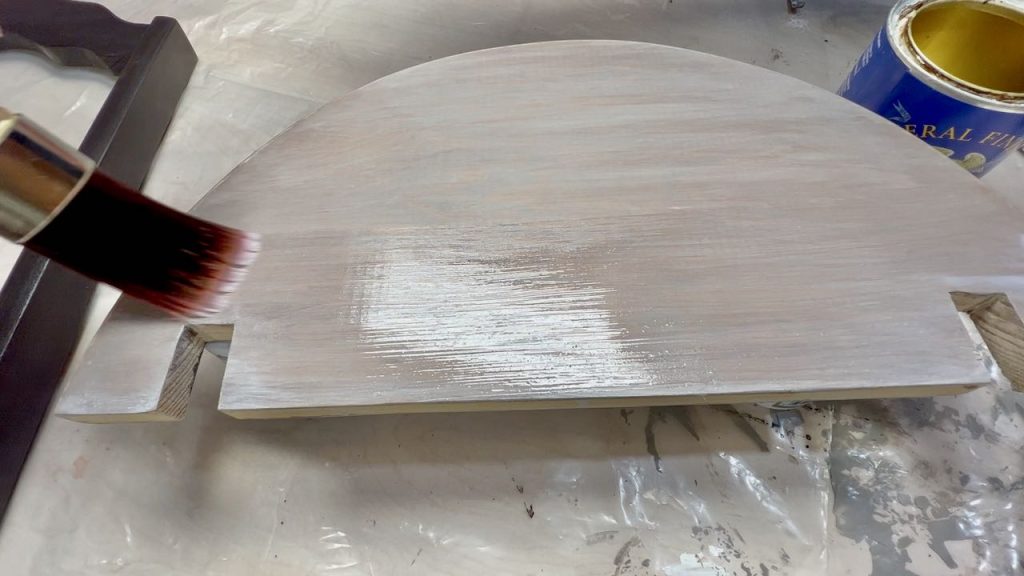
You are a GUI agent. You are given a task and a screenshot of the screen. Output one action in this format:
    pyautogui.click(x=<x>, y=<y>)
    Task: Click on the white color floor cover drop clotgh
    The image size is (1024, 576).
    Given the screenshot: What is the action you would take?
    pyautogui.click(x=303, y=77)